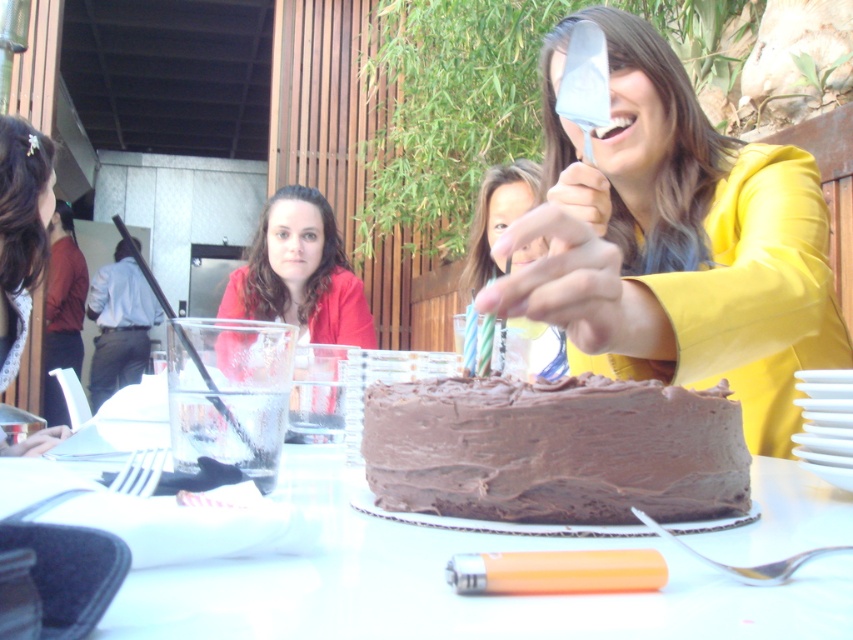
Between yellow matte jacket at upper right and chocolate matte cake at center, which one has less height?

chocolate matte cake at center is shorter.

Who is more distant from viewer, (566, 147) or (573, 394)?

The point (566, 147) is more distant.

Find the location of `yellow matte jacket at upper right`. yellow matte jacket at upper right is located at coordinates (676, 241).

Between yellow matte jacket at upper right and smooth skin face at center, which one has more height?

Standing taller between the two is yellow matte jacket at upper right.

What do you see at coordinates (676, 241) in the screenshot?
I see `yellow matte jacket at upper right` at bounding box center [676, 241].

The image size is (853, 640). In order to click on yellow matte jacket at upper right in this screenshot , I will do `click(676, 241)`.

Which is more to the right, smooth white table at center or smooth skin face at center?

Positioned to the right is smooth skin face at center.

Is point (596, 636) farther from viewer compared to point (512, 193)?

That is False.

Where is `smooth white table at center`? The width and height of the screenshot is (853, 640). smooth white table at center is located at coordinates pos(445,584).